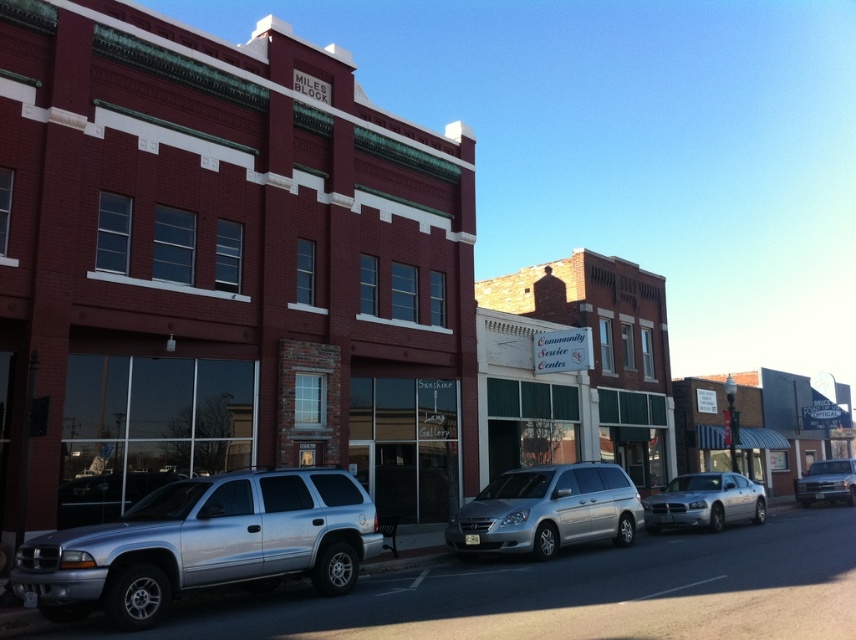
You are a delivery driver who needs to park your vehicle in a parking spot that is 1.8 meters in height. You have two options available next to the Miles Block building. One is the silver metallic minivan at center and the other is the silver metallic truck at right. Which vehicle can fit into the parking spot without any issues?

The silver metallic minivan at center has a lesser height compared to the silver metallic truck at right, so the minivan can fit into the parking spot that is 1.8 meters in height without any issues, while the truck may be too tall.

You are a delivery driver who needs to park your vehicle in this area. There is a silver metallic suv at left. Based on its position, can you estimate if there is enough space to park your truck, which is 6 meters long, next to it without overlapping?

The silver metallic suv at left is located at point [201,545]. Without specific spatial dimensions of the area, it is impossible to determine if there is enough space to park a 6 meter long truck next to it without overlapping. More information about the available parking area is needed.

You are a delivery person who needs to park your silver metallic minivan at center in this street scene. The parking spot you want is located at coordinates point 0.5, 0.5. Can you safely park your vehicle there without moving any other objects?

The silver metallic minivan at center is already positioned at point [547,509], which is not the desired parking spot at [428,320]. Therefore, you can safely move it to the parking spot as there are no other objects mentioned in the scene that would obstruct the path.